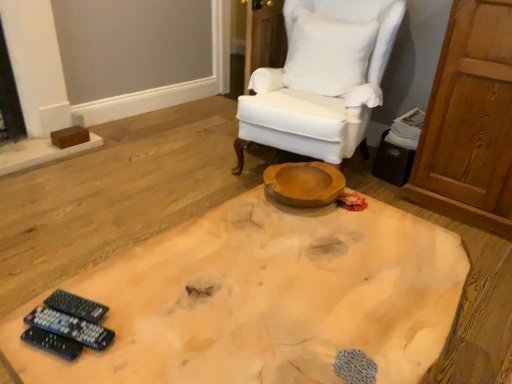
Where is `free spot to the right of black plastic remote controls at lower left, which ranks as the 3th remote control in back-to-front order`? free spot to the right of black plastic remote controls at lower left, which ranks as the 3th remote control in back-to-front order is located at coordinates (x=137, y=336).